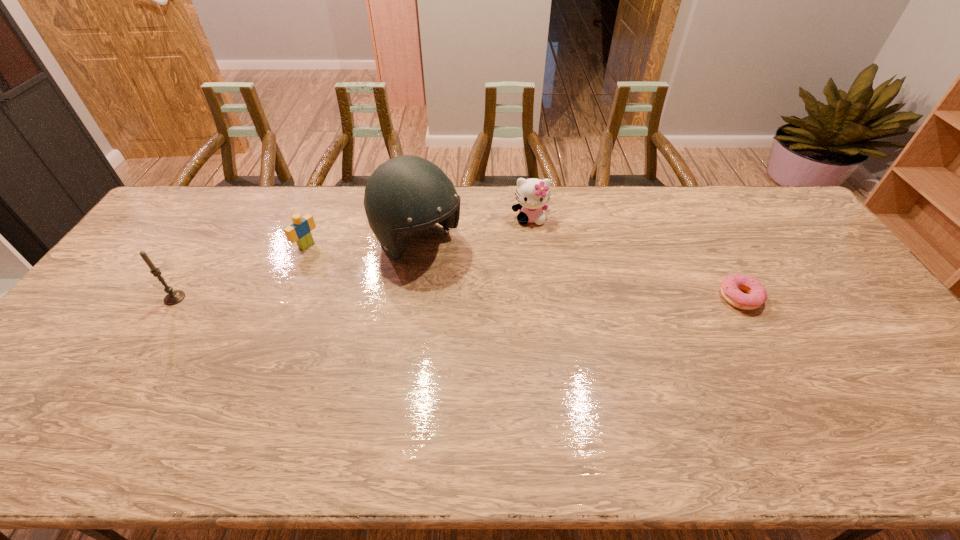
Where is `football helmet located at the far edge`? This screenshot has height=540, width=960. football helmet located at the far edge is located at coordinates (406, 193).

The height and width of the screenshot is (540, 960). What are the coordinates of `kitten that is at the far edge` in the screenshot? It's located at (532, 194).

This screenshot has height=540, width=960. What are the coordinates of `free region at the far edge` in the screenshot? It's located at (551, 219).

The width and height of the screenshot is (960, 540). I want to click on free space at the near edge of the desktop, so click(x=701, y=411).

The width and height of the screenshot is (960, 540). In the image, there is a desktop. Find the location of `vacant space at the left edge`. vacant space at the left edge is located at coordinates (161, 230).

This screenshot has height=540, width=960. In the image, there is a desktop. Identify the location of vacant space at the right edge. (827, 276).

At what (x,y) coordinates should I click in order to perform the action: click on vacant space at the far right corner of the desktop. Please return your answer as a coordinate pair (x, y). Looking at the image, I should click on (777, 195).

Locate an element on the screen. Image resolution: width=960 pixels, height=540 pixels. free point between the football helmet and the shortest object is located at coordinates (579, 270).

Identify the location of empty space that is in between the football helmet and the leftmost object. (297, 271).

Image resolution: width=960 pixels, height=540 pixels. I want to click on free space that is in between the rightmost object and the football helmet, so click(579, 270).